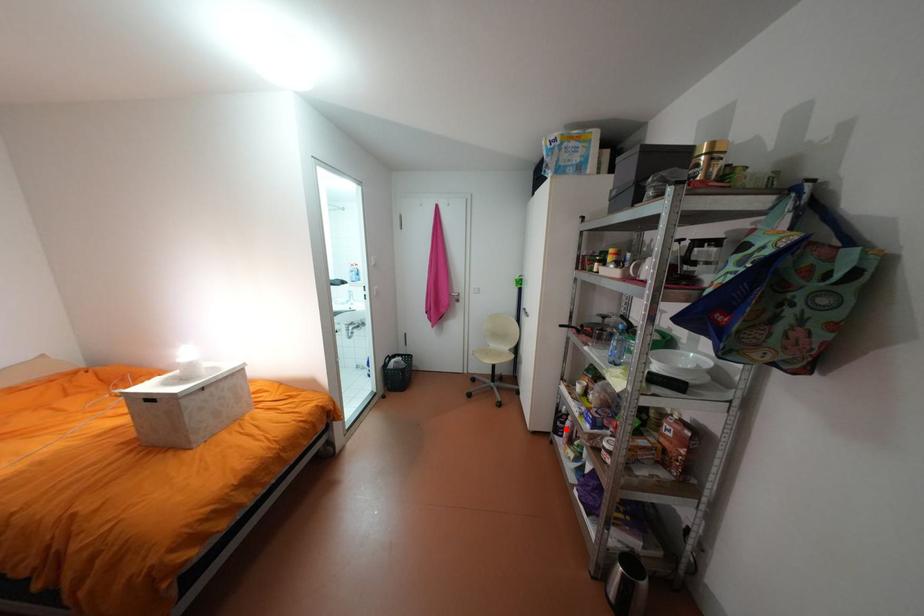
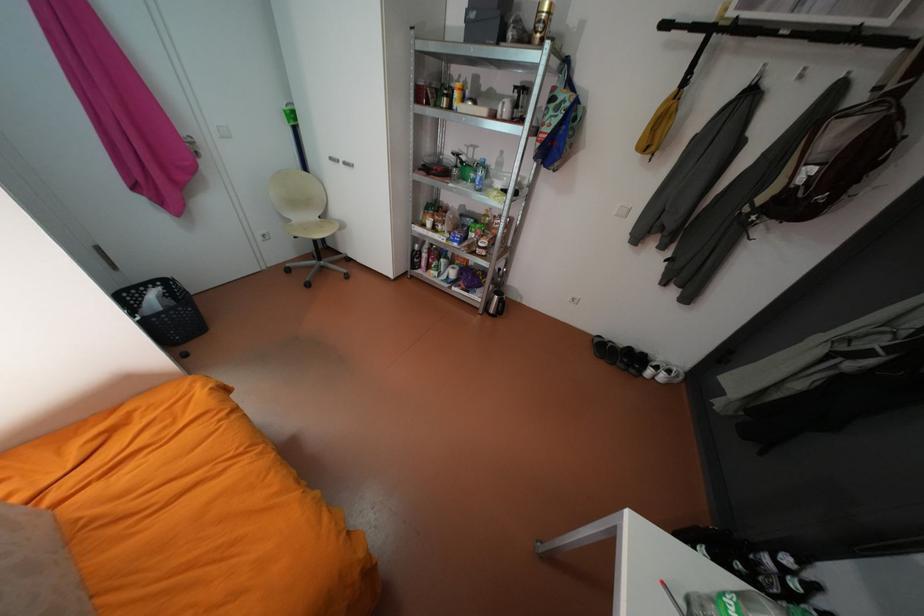
Question: I am providing you with two images of the same scene from different viewpoints. Given a red point in image1, look at the same physical point in image2. Is it:

Choices:
 (A) Closer to the viewpoint
 (B) Farther from the viewpoint

Answer: (A)